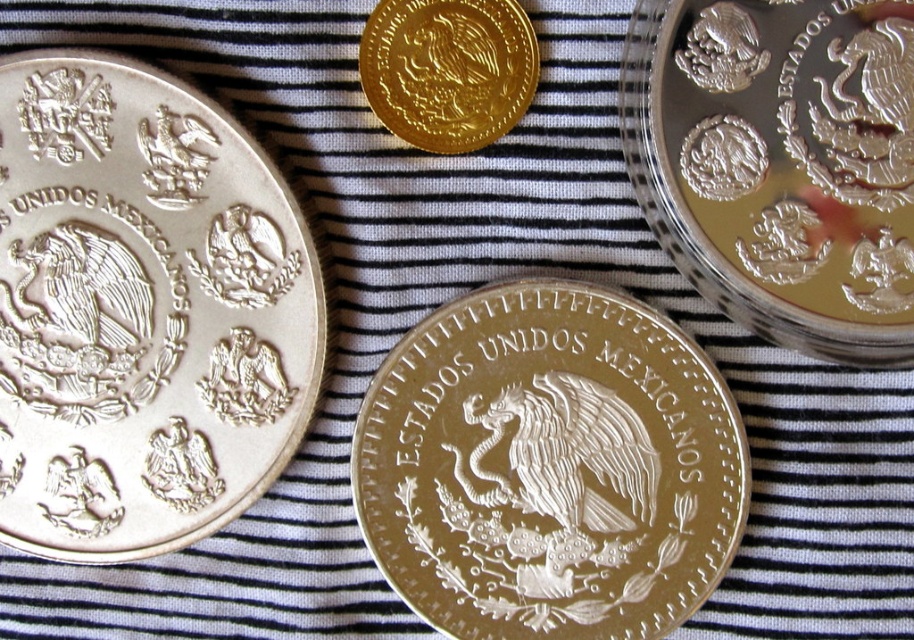
Locate an element on the screen. This screenshot has width=914, height=640. gold plated coin at center is located at coordinates (549, 467).

Does point (630, 433) lie behind point (610, 422)?

Yes, it is.

The image size is (914, 640). What are the coordinates of `gold plated coin at center` in the screenshot? It's located at (549, 467).

Who is more distant from viewer, (134, 109) or (390, 56)?

Positioned behind is point (390, 56).

Consider the image. Does silver/metallic coin at left appear on the right side of gold shiny coin at upper center?

Incorrect, silver/metallic coin at left is not on the right side of gold shiny coin at upper center.

Is point (143, 524) positioned after point (409, 99)?

Yes, it is behind point (409, 99).

Find the location of `silver/metallic coin at left`. silver/metallic coin at left is located at coordinates (142, 310).

Between silver/golden metallic coin at upper right and satin gold eagle at center, which one has more height?

Standing taller between the two is silver/golden metallic coin at upper right.

Is silver/golden metallic coin at upper right wider than satin gold eagle at center?

Correct, the width of silver/golden metallic coin at upper right exceeds that of satin gold eagle at center.

Locate an element on the screen. This screenshot has width=914, height=640. silver/golden metallic coin at upper right is located at coordinates point(781,163).